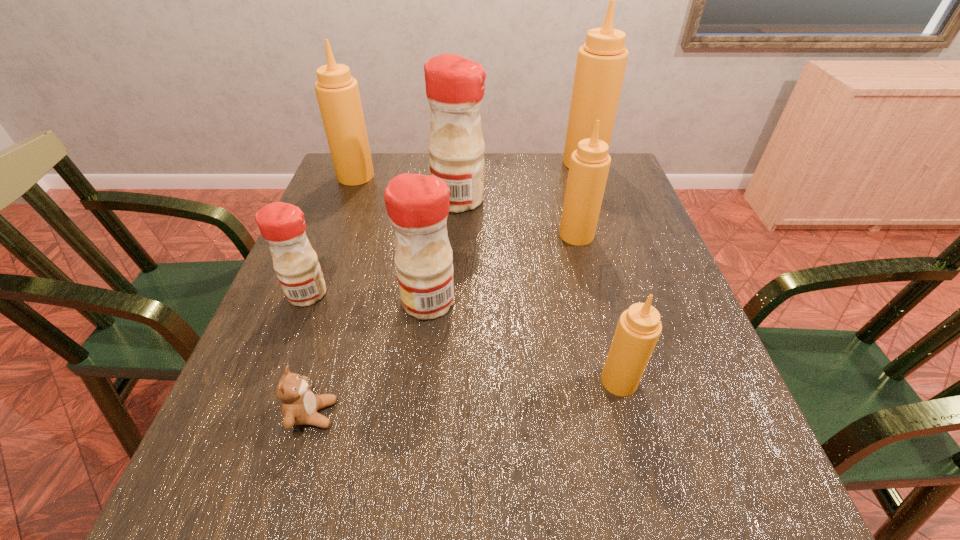
Find the location of a particular element. The image size is (960, 540). the tallest object is located at coordinates (601, 62).

The height and width of the screenshot is (540, 960). Identify the location of the biggest tan condiment. (601, 62).

Find the location of a particular element. the biggest red condiment is located at coordinates (455, 86).

Find the location of a particular element. This screenshot has width=960, height=540. the leftmost tan condiment is located at coordinates (337, 92).

I want to click on the fourth farthest condiment, so click(589, 166).

This screenshot has width=960, height=540. What are the coordinates of `the second smallest tan condiment` in the screenshot? It's located at (589, 166).

Where is `the second biggest red condiment`? the second biggest red condiment is located at coordinates (417, 205).

This screenshot has height=540, width=960. In order to click on the leftmost red condiment in this screenshot , I will do `click(282, 225)`.

Locate an element on the screen. the nearest condiment is located at coordinates (639, 327).

Where is `the smallest tan condiment`? This screenshot has height=540, width=960. the smallest tan condiment is located at coordinates (639, 327).